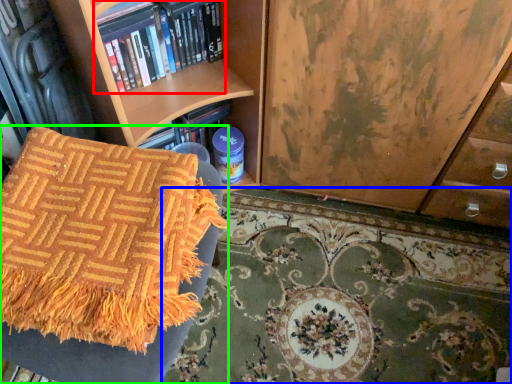
Question: Which is farther away from book (highlighted by a red box)? mat (highlighted by a blue box) or furniture (highlighted by a green box)?

Choices:
 (A) mat
 (B) furniture

Answer: (A)